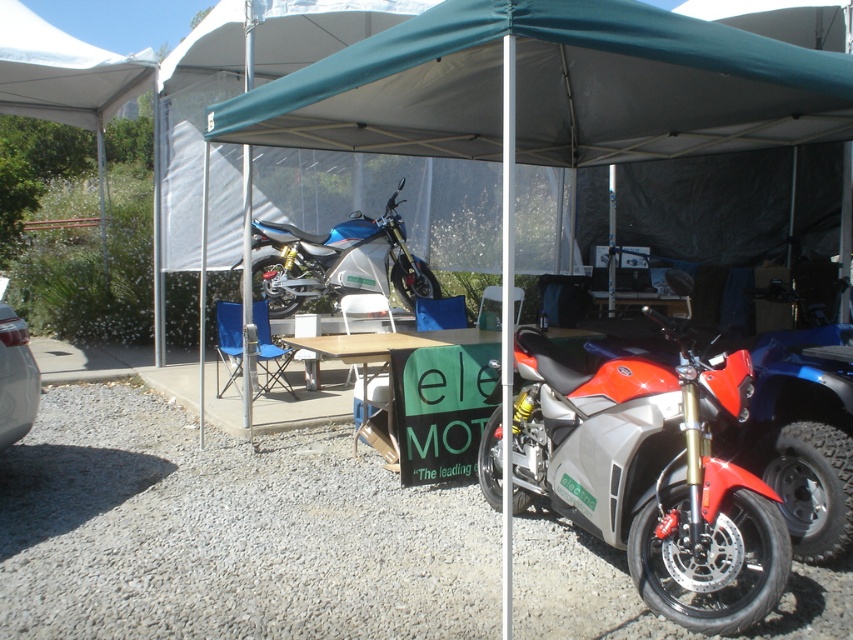
Question: Which of the following is the farthest from the observer?

Choices:
 (A) (1, 385)
 (B) (625, 371)
 (C) (312, 237)

Answer: (C)

Question: Can you confirm if matte silver motorcycle at center is wider than blue metallic motorcycle at center?

Choices:
 (A) no
 (B) yes

Answer: (A)

Question: Is the position of matte silver motorcycle at center more distant than that of blue metallic motorcycle at center?

Choices:
 (A) yes
 (B) no

Answer: (B)

Question: Is matte silver motorcycle at center bigger than blue metallic motorcycle at center?

Choices:
 (A) no
 (B) yes

Answer: (A)

Question: Which of the following is the farthest from the observer?

Choices:
 (A) (9, 310)
 (B) (376, 353)
 (C) (395, 243)
 (D) (659, 445)

Answer: (C)

Question: Which is nearer to the matte silver motorcycle at center?

Choices:
 (A) wooden table at center
 (B) metallic silver car at lower left
 (C) blue metallic motorcycle at center

Answer: (A)